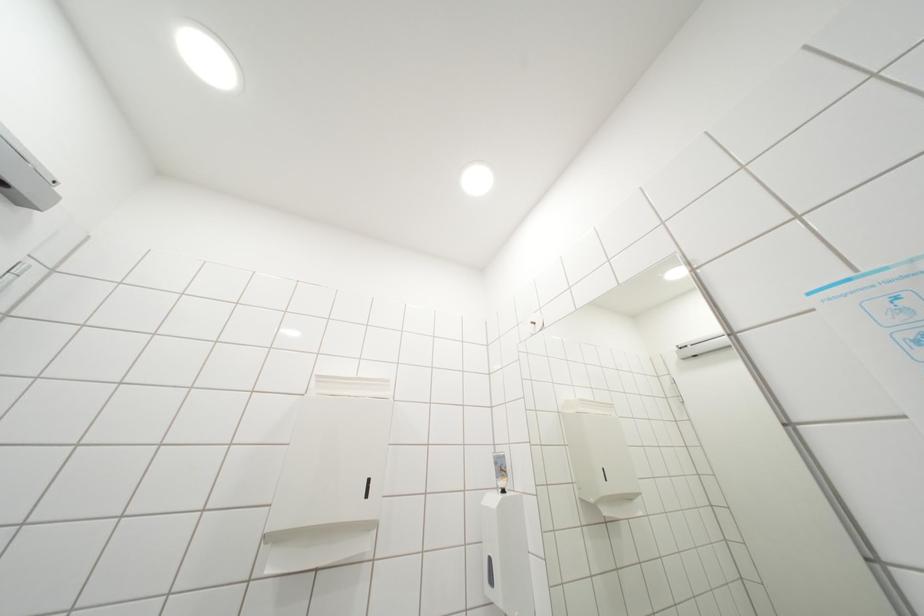
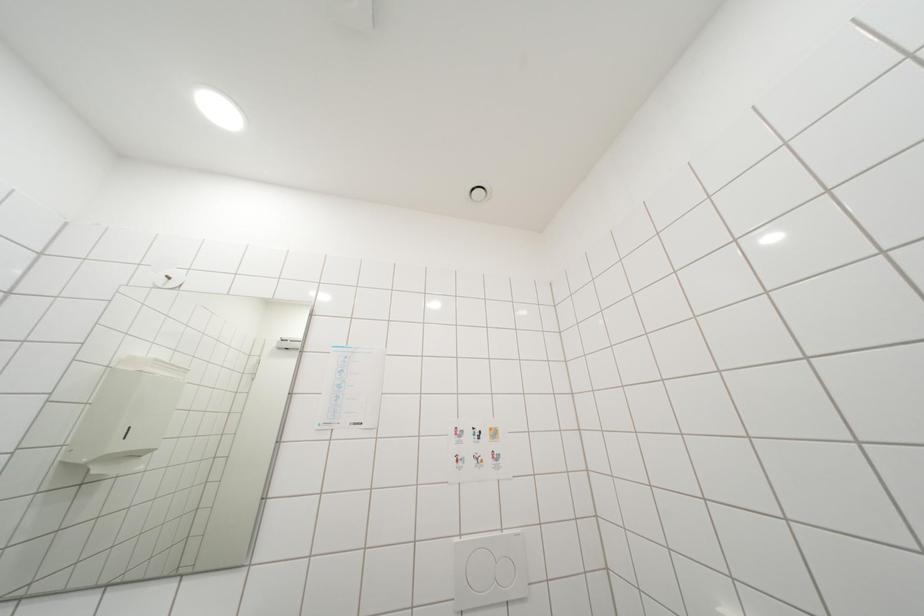
Based on the continuous images, in which direction is the camera rotating?

The camera's rotation is toward right-up.